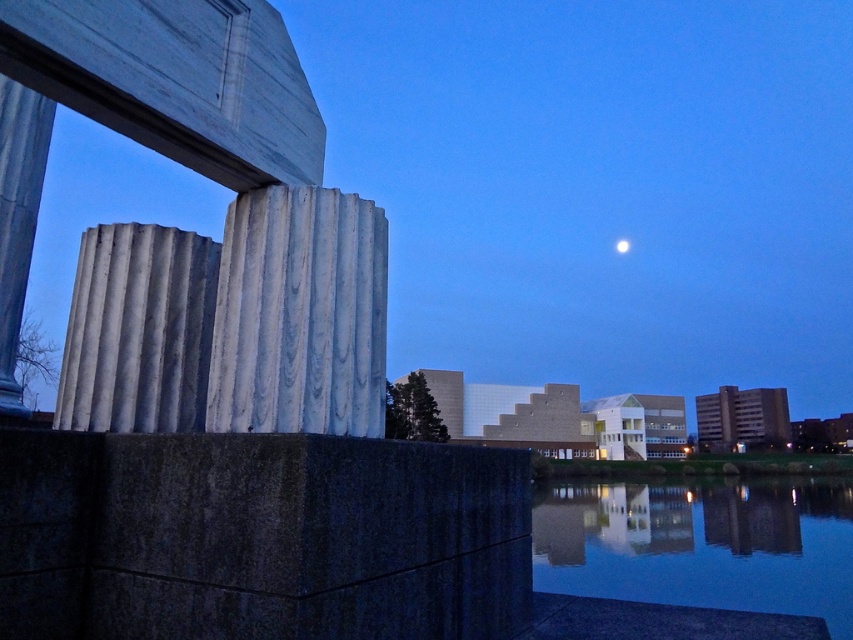
Can you confirm if white corrugated concrete pillar at left is positioned to the left of white glossy moon at upper center?

Correct, you'll find white corrugated concrete pillar at left to the left of white glossy moon at upper center.

Find the location of a particular element. white corrugated concrete pillar at left is located at coordinates (138, 330).

Between point (271, 257) and point (614, 246), which one is positioned in front?

Point (271, 257)

The height and width of the screenshot is (640, 853). What do you see at coordinates (299, 314) in the screenshot?
I see `white marble column at center` at bounding box center [299, 314].

At what (x,y) coordinates should I click in order to perform the action: click on white marble column at center. Please return your answer as a coordinate pair (x, y). This screenshot has height=640, width=853. Looking at the image, I should click on (299, 314).

Which is above, white marble column at center or white corrugated concrete pillar at left?

white marble column at center is above.

Does point (357, 196) come in front of point (80, 310)?

Yes, point (357, 196) is closer to viewer.

Which is behind, point (303, 376) or point (115, 364)?

The point (115, 364) is more distant.

Identify the location of white marble column at center. This screenshot has height=640, width=853. (299, 314).